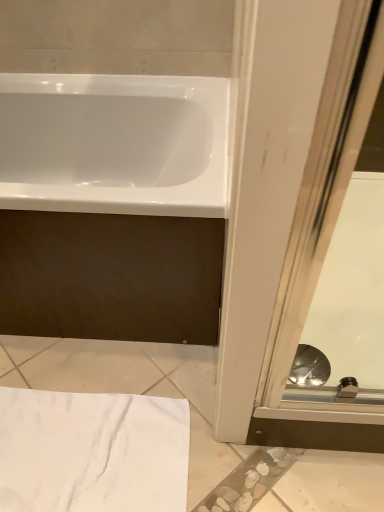
Question: From the image's perspective, is white glossy bathtub at upper left positioned above or below white cotton towel at lower left?

Choices:
 (A) above
 (B) below

Answer: (A)

Question: Considering the positions of point (66, 143) and point (168, 415), is point (66, 143) closer or farther from the camera than point (168, 415)?

Choices:
 (A) farther
 (B) closer

Answer: (A)

Question: Considering the real-world distances, which object is closest to the white glossy bathtub at upper left?

Choices:
 (A) white cotton towel at lower left
 (B) transparent glass screen door at lower right

Answer: (B)

Question: Which object is positioned farthest from the white cotton towel at lower left?

Choices:
 (A) white glossy bathtub at upper left
 (B) transparent glass screen door at lower right

Answer: (A)